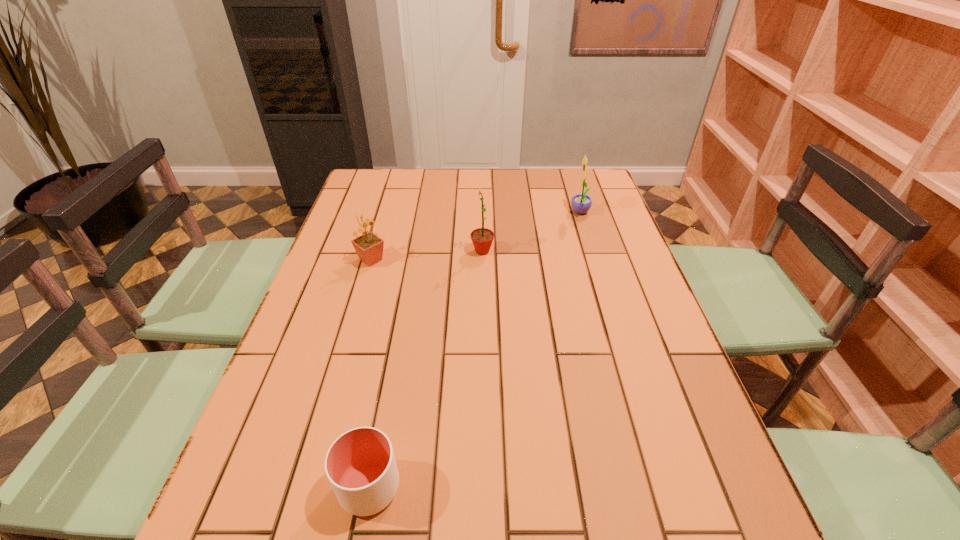
Image resolution: width=960 pixels, height=540 pixels. I want to click on unoccupied area between the farthest object and the second object from right to left, so click(x=531, y=232).

At what (x,y) coordinates should I click in order to perform the action: click on object that can be found as the second closest to the nearest object. Please return your answer as a coordinate pair (x, y). Looking at the image, I should click on (482, 238).

Point out which object is positioned as the nearest to the second object from right to left. Please provide its 2D coordinates. Your answer should be formatted as a tuple, i.e. [(x, y)], where the tuple contains the x and y coordinates of a point satisfying the conditions above.

[(369, 247)]

Identify which sunflower is located as the nearest to the shortest object. Please provide its 2D coordinates. Your answer should be formatted as a tuple, i.e. [(x, y)], where the tuple contains the x and y coordinates of a point satisfying the conditions above.

[(369, 247)]

Where is `sunflower that stands as the closest to the leftmost sunflower`? The image size is (960, 540). sunflower that stands as the closest to the leftmost sunflower is located at coordinates (482, 238).

Find the location of a particular element. The image size is (960, 540). free spot that satisfies the following two spatial constraints: 1. at the front of the leftmost sunflower with flowers visible; 2. on the left side of the shortest object is located at coordinates (303, 487).

Locate an element on the screen. free space that satisfies the following two spatial constraints: 1. at the front of the leftmost object with flowers visible; 2. on the right side of the cup is located at coordinates (303, 487).

Find the location of a particular element. Image resolution: width=960 pixels, height=540 pixels. free spot that satisfies the following two spatial constraints: 1. at the front of the shortest sunflower with flowers visible; 2. on the left side of the nearest object is located at coordinates (303, 487).